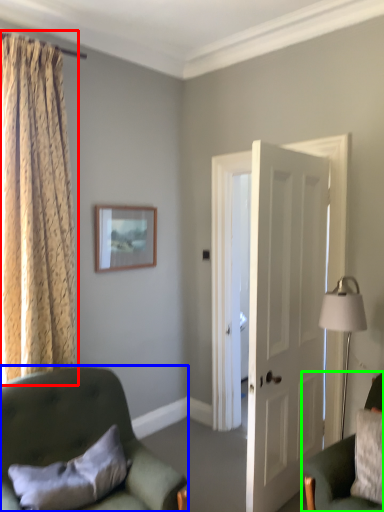
Question: Considering the real-world distances, which object is closest to curtain (highlighted by a red box)? chair (highlighted by a blue box) or chair (highlighted by a green box).

Choices:
 (A) chair
 (B) chair

Answer: (A)